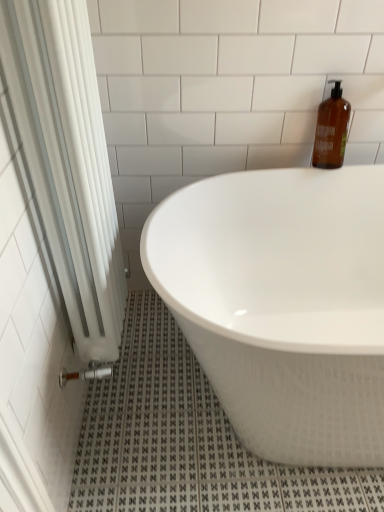
Where is `white fabric shower curtain at left`? white fabric shower curtain at left is located at coordinates (68, 161).

The width and height of the screenshot is (384, 512). What do you see at coordinates (331, 130) in the screenshot? I see `amber glass bottle at upper right` at bounding box center [331, 130].

I want to click on white glossy bathtub at center, so click(282, 305).

Measure the distance from white fabric shower curtain at left to white glossy bathtub at center.

white fabric shower curtain at left and white glossy bathtub at center are 15.01 inches apart from each other.

Who is shorter, white fabric shower curtain at left or white glossy bathtub at center?

white glossy bathtub at center.

Is white fabric shower curtain at left located outside white glossy bathtub at center?

That's correct, white fabric shower curtain at left is outside of white glossy bathtub at center.

How different are the orientations of white fabric shower curtain at left and white glossy bathtub at center in degrees?

There is a 90-degree angle between the facing directions of white fabric shower curtain at left and white glossy bathtub at center.

Does white fabric shower curtain at left have a smaller size compared to amber glass bottle at upper right?

Actually, white fabric shower curtain at left might be larger than amber glass bottle at upper right.

Is white fabric shower curtain at left aimed at amber glass bottle at upper right?

No, white fabric shower curtain at left is not facing towards amber glass bottle at upper right.

Can you confirm if white fabric shower curtain at left is thinner than amber glass bottle at upper right?

No.

From the image's perspective, is white fabric shower curtain at left located above or below amber glass bottle at upper right?

From the image's perspective, white fabric shower curtain at left appears below amber glass bottle at upper right.

Considering the sizes of amber glass bottle at upper right and white fabric shower curtain at left in the image, is amber glass bottle at upper right wider or thinner than white fabric shower curtain at left?

Clearly, amber glass bottle at upper right has less width compared to white fabric shower curtain at left.

Considering the relative sizes of amber glass bottle at upper right and white fabric shower curtain at left in the image provided, is amber glass bottle at upper right shorter than white fabric shower curtain at left?

Indeed, amber glass bottle at upper right has a lesser height compared to white fabric shower curtain at left.

Based on the photo, which is more to the left, amber glass bottle at upper right or white fabric shower curtain at left?

white fabric shower curtain at left.

From the picture: From a real-world perspective, is amber glass bottle at upper right located higher than white fabric shower curtain at left?

Yes, from a real-world perspective, amber glass bottle at upper right is over white fabric shower curtain at left

Considering the sizes of objects amber glass bottle at upper right and white glossy bathtub at center in the image provided, who is taller, amber glass bottle at upper right or white glossy bathtub at center?

white glossy bathtub at center.

Which is in front, point (322, 150) or point (327, 332)?

Point (322, 150)

From the picture: From a real-world perspective, is white glossy bathtub at center on top of white fabric shower curtain at left?

No.

Does white glossy bathtub at center touch white fabric shower curtain at left?

No, white glossy bathtub at center is not making contact with white fabric shower curtain at left.

Where is `shower curtain above the white glossy bathtub at center (from the image's perspective)`? This screenshot has width=384, height=512. shower curtain above the white glossy bathtub at center (from the image's perspective) is located at coordinates (68, 161).

Is white glossy bathtub at center located outside white fabric shower curtain at left?

That's correct, white glossy bathtub at center is outside of white fabric shower curtain at left.

Considering the positions of points (301, 362) and (320, 125), is point (301, 362) closer to camera compared to point (320, 125)?

Yes, it is.

Is white glossy bathtub at center to the right of amber glass bottle at upper right from the viewer's perspective?

No, white glossy bathtub at center is not to the right of amber glass bottle at upper right.

Can you tell me how much white glossy bathtub at center and amber glass bottle at upper right differ in facing direction?

The angle between the facing direction of white glossy bathtub at center and the facing direction of amber glass bottle at upper right is 0.916 degrees.

Which of these two, white glossy bathtub at center or amber glass bottle at upper right, stands taller?

white glossy bathtub at center is taller.

The image size is (384, 512). I want to click on shower curtain located in front of the white glossy bathtub at center, so click(68, 161).

Where is `bottle behind the white fabric shower curtain at left`? bottle behind the white fabric shower curtain at left is located at coordinates (331, 130).

Which object lies further to the anchor point amber glass bottle at upper right, white fabric shower curtain at left or white glossy bathtub at center?

white fabric shower curtain at left.

Considering their positions, is white glossy bathtub at center positioned closer to white fabric shower curtain at left than amber glass bottle at upper right?

Among the two, white glossy bathtub at center is located nearer to white fabric shower curtain at left.

Looking at the image, which one is located closer to amber glass bottle at upper right, white glossy bathtub at center or white fabric shower curtain at left?

white glossy bathtub at center lies closer to amber glass bottle at upper right than the other object.

From the image, which object appears to be farther from white fabric shower curtain at left, amber glass bottle at upper right or white glossy bathtub at center?

amber glass bottle at upper right.

Looking at the image, which one is located closer to white glossy bathtub at center, amber glass bottle at upper right or white fabric shower curtain at left?

The object closer to white glossy bathtub at center is white fabric shower curtain at left.

Based on their spatial positions, is white fabric shower curtain at left or amber glass bottle at upper right closer to white glossy bathtub at center?

white fabric shower curtain at left is positioned closer to the anchor white glossy bathtub at center.

Where is `bathtub between white fabric shower curtain at left and amber glass bottle at upper right`? Image resolution: width=384 pixels, height=512 pixels. bathtub between white fabric shower curtain at left and amber glass bottle at upper right is located at coordinates (282, 305).